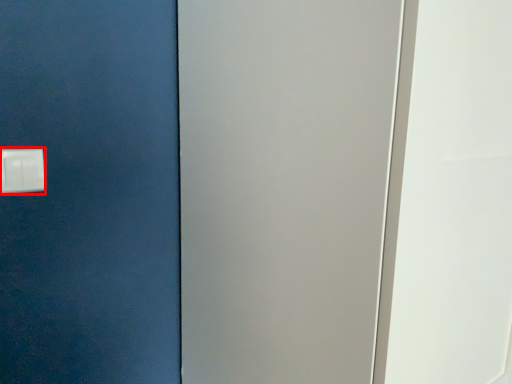
Question: Considering the relative positions of light switch (annotated by the red box) and screen door in the image provided, where is light switch (annotated by the red box) located with respect to the staircase?

Choices:
 (A) left
 (B) right

Answer: (A)